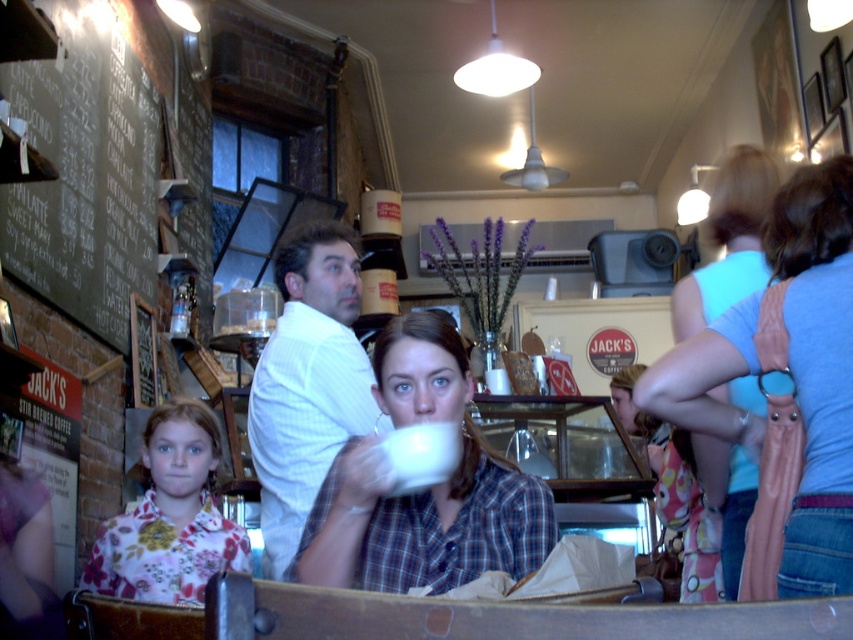
From the picture: Who is taller, matte white cup at center or floral fabric shirt at lower left?

With more height is matte white cup at center.

Does point (463, 401) come in front of point (135, 600)?

No, it is behind (135, 600).

Who is more distant from viewer, (444, 528) or (131, 570)?

The point (131, 570) is more distant.

The height and width of the screenshot is (640, 853). I want to click on matte white cup at center, so click(x=425, y=490).

This screenshot has width=853, height=640. What do you see at coordinates (425, 490) in the screenshot?
I see `matte white cup at center` at bounding box center [425, 490].

Which is behind, point (494, 504) or point (316, 492)?

The point (316, 492) is behind.

Between point (341, 458) and point (347, 340), which one is positioned behind?

The point (347, 340) is behind.

The height and width of the screenshot is (640, 853). In order to click on matte white cup at center in this screenshot , I will do `click(425, 490)`.

Describe the element at coordinates (786, 378) in the screenshot. I see `light blue fabric purse at right` at that location.

Between light blue fabric purse at right and floral fabric shirt at lower left, which one has less height?

floral fabric shirt at lower left

Where is `light blue fabric purse at right`? Image resolution: width=853 pixels, height=640 pixels. light blue fabric purse at right is located at coordinates (786, 378).